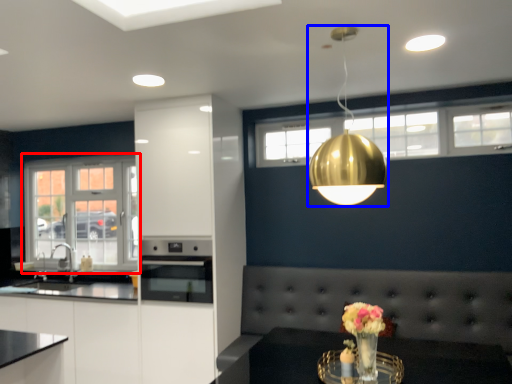
Question: Which point is further to the camera, window (highlighted by a red box) or lamp (highlighted by a blue box)?

Choices:
 (A) window
 (B) lamp

Answer: (A)